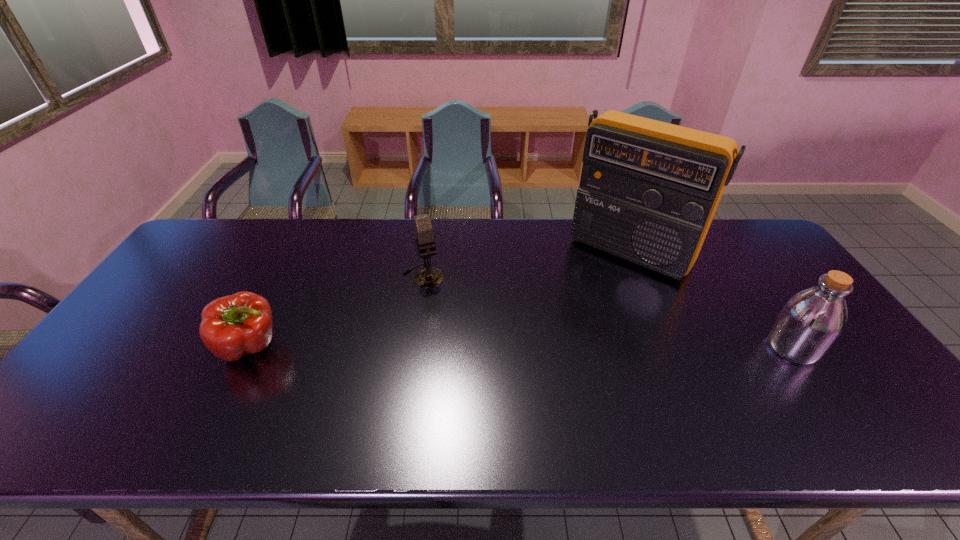
Identify the location of object that is the nearest to the radio receiver. The height and width of the screenshot is (540, 960). (811, 321).

Select which object is the third closest to the bottle. Please provide its 2D coordinates. Your answer should be formatted as a tuple, i.e. [(x, y)], where the tuple contains the x and y coordinates of a point satisfying the conditions above.

[(233, 326)]

This screenshot has height=540, width=960. Find the location of `vacant region that satisfies the following two spatial constraints: 1. on the front side of the bottle; 2. on the left side of the shortest object`. vacant region that satisfies the following two spatial constraints: 1. on the front side of the bottle; 2. on the left side of the shortest object is located at coordinates (251, 347).

The width and height of the screenshot is (960, 540). What are the coordinates of `free location that satisfies the following two spatial constraints: 1. on the back side of the radio receiver; 2. on the right side of the second object from left to right` in the screenshot? It's located at (427, 252).

I want to click on vacant point that satisfies the following two spatial constraints: 1. on the front side of the rightmost object; 2. on the right side of the tallest object, so click(670, 347).

At what (x,y) coordinates should I click in order to perform the action: click on free point that satisfies the following two spatial constraints: 1. on the front side of the pepper; 2. on the left side of the bottle. Please return your answer as a coordinate pair (x, y). This screenshot has height=540, width=960. Looking at the image, I should click on (251, 347).